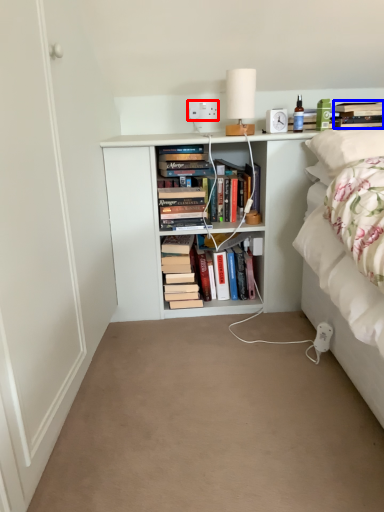
Question: Which point is further to the camera, electric outlet (highlighted by a red box) or book (highlighted by a blue box)?

Choices:
 (A) electric outlet
 (B) book

Answer: (A)